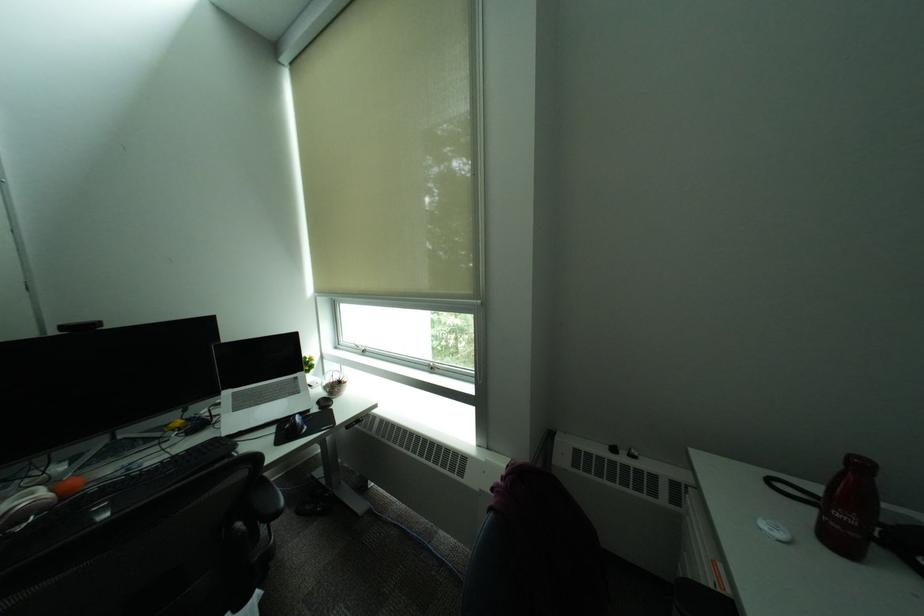
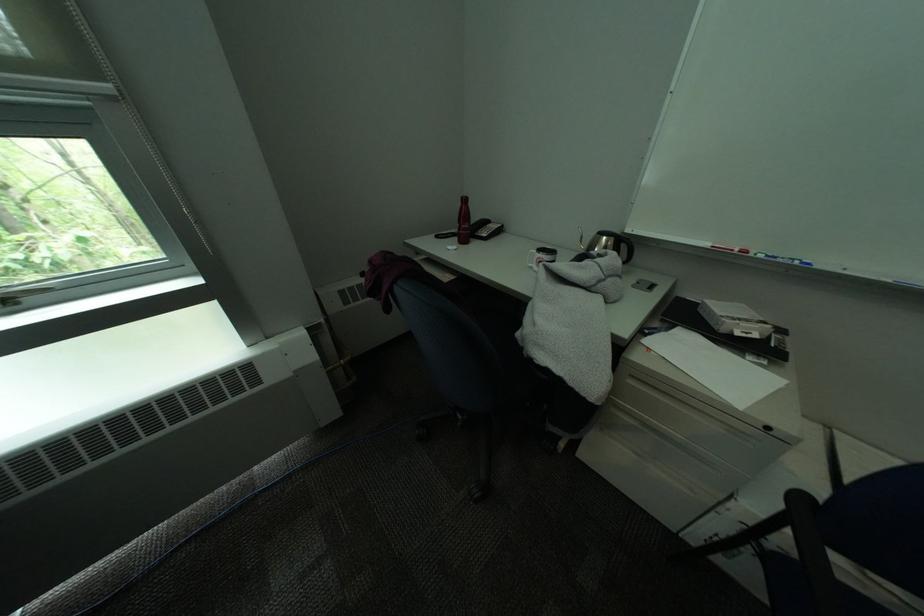
From the picture: How did the camera likely rotate?

The camera rotated toward right-down.